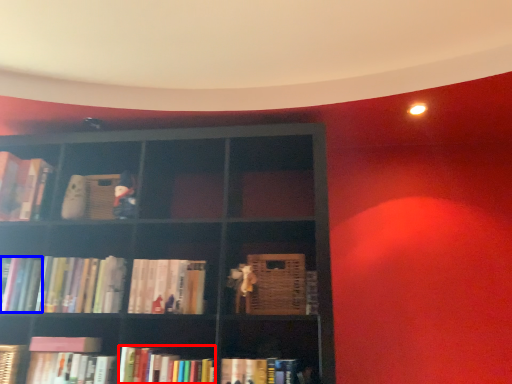
Question: Which object is closer to the camera taking this photo, book (highlighted by a red box) or book (highlighted by a blue box)?

Choices:
 (A) book
 (B) book

Answer: (A)